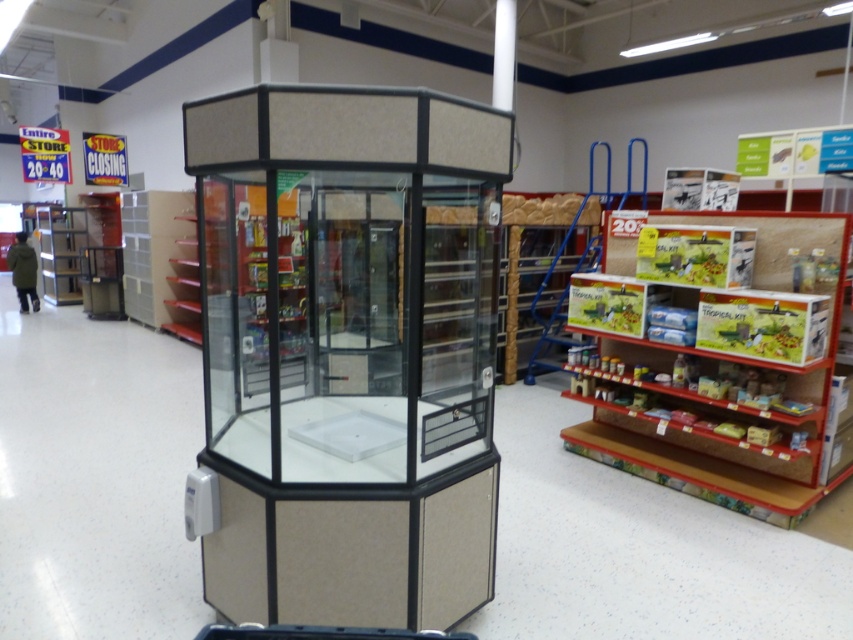
Does point (260, 403) lie behind point (775, 467)?

No, it is in front of (775, 467).

What are the coordinates of `matte glass display case at center` in the screenshot? It's located at click(x=347, y=352).

Is point (393, 237) closer to viewer compared to point (618, 451)?

No, (393, 237) is further to viewer.

Where is `matte glass display case at center`? The width and height of the screenshot is (853, 640). matte glass display case at center is located at coordinates (347, 352).

Between wooden textured shelf at right and green matte jacket at left, which one is positioned higher?

Positioned higher is green matte jacket at left.

Can you confirm if wooden textured shelf at right is thinner than green matte jacket at left?

No.

Is point (735, 500) less distant than point (12, 243)?

Yes, it is.

This screenshot has height=640, width=853. Find the location of `wooden textured shelf at right`. wooden textured shelf at right is located at coordinates (722, 387).

Can you confirm if matte glass display case at center is positioned above green matte jacket at left?

Incorrect, matte glass display case at center is not positioned above green matte jacket at left.

Does matte glass display case at center come behind green matte jacket at left?

No, it is not.

The height and width of the screenshot is (640, 853). In order to click on matte glass display case at center in this screenshot , I will do `click(347, 352)`.